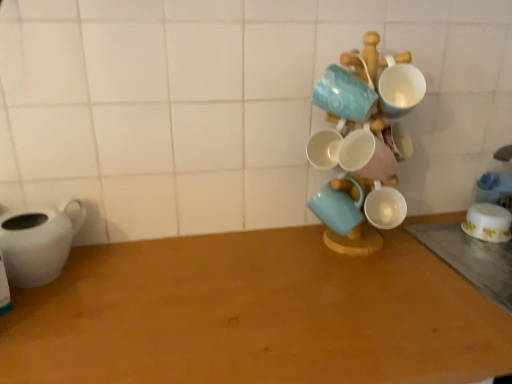
Find the location of a particular element. Image resolution: width=512 pixels, height=384 pixels. vacant area on top of wooden table at center, positioned as the 2th table in right-to-left order (from a real-world perspective) is located at coordinates (285, 296).